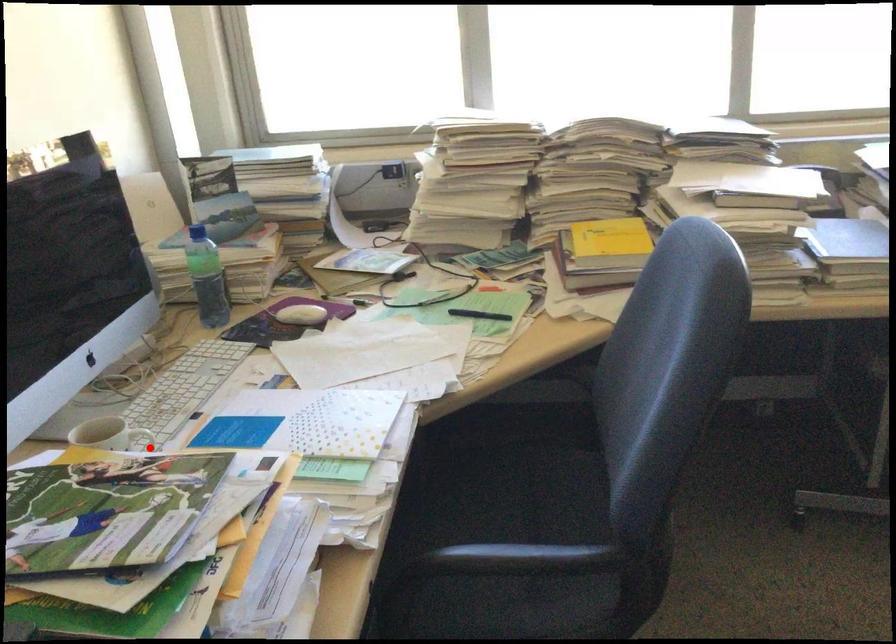
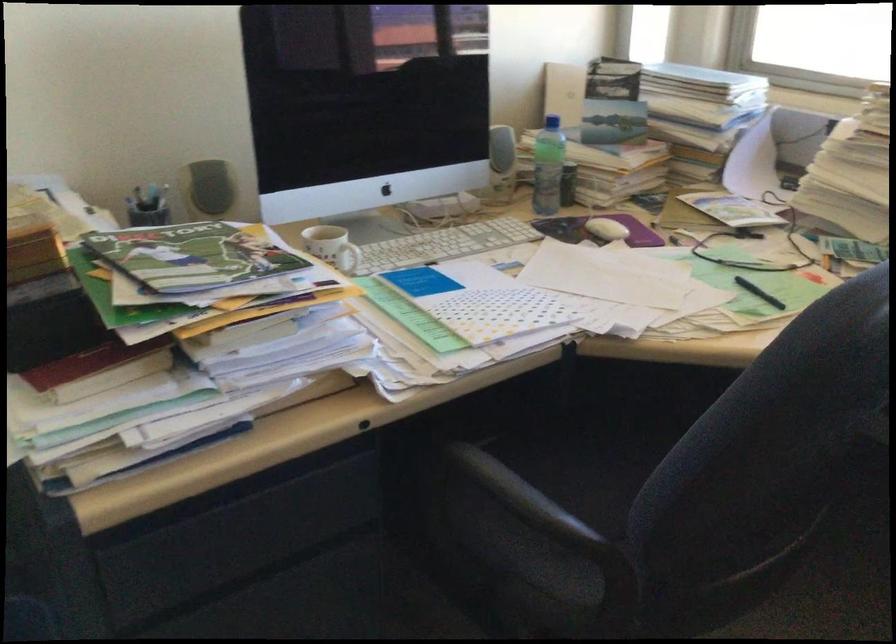
Question: I am providing you with two images of the same scene from different viewpoints. A red point is shown in image1. For the corresponding object point in image2, is it positioned nearer or farther from the camera?

Choices:
 (A) Nearer
 (B) Farther

Answer: (B)